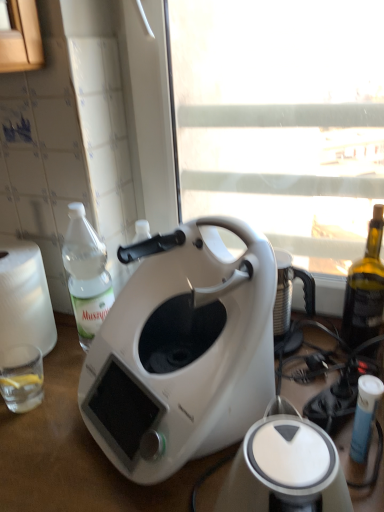
Question: In terms of size, does white plastic window screen at center appear bigger or smaller than white matte coffee maker at center?

Choices:
 (A) small
 (B) big

Answer: (B)

Question: Looking at their shapes, would you say white plastic window screen at center is wider or thinner than white matte coffee maker at center?

Choices:
 (A) thin
 (B) wide

Answer: (A)

Question: Which of these objects is positioned closest to the clear plastic bottle at left?

Choices:
 (A) white matte coffee maker at center
 (B) clear glass at lower left
 (C) white matte table at center
 (D) white plastic toaster at center
 (E) white plastic window screen at center

Answer: (B)

Question: Estimate the real-world distances between objects in this image. Which object is closer to the white plastic window screen at center?

Choices:
 (A) clear glass at lower left
 (B) white matte table at center
 (C) white matte coffee maker at center
 (D) white plastic toaster at center
 (E) clear plastic bottle at left

Answer: (C)